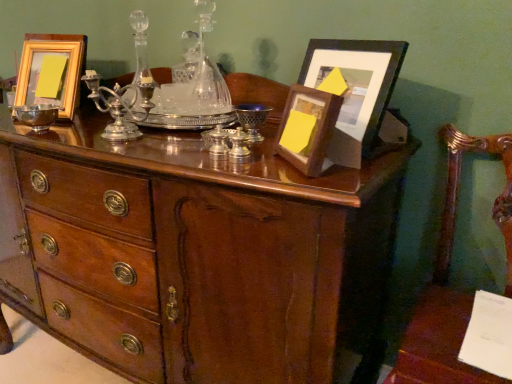
The image size is (512, 384). What are the coordinates of `vacant space situated on the left part of silver metallic candle holder at center, which appears as the second candle holder when viewed from the back` in the screenshot? It's located at (155, 153).